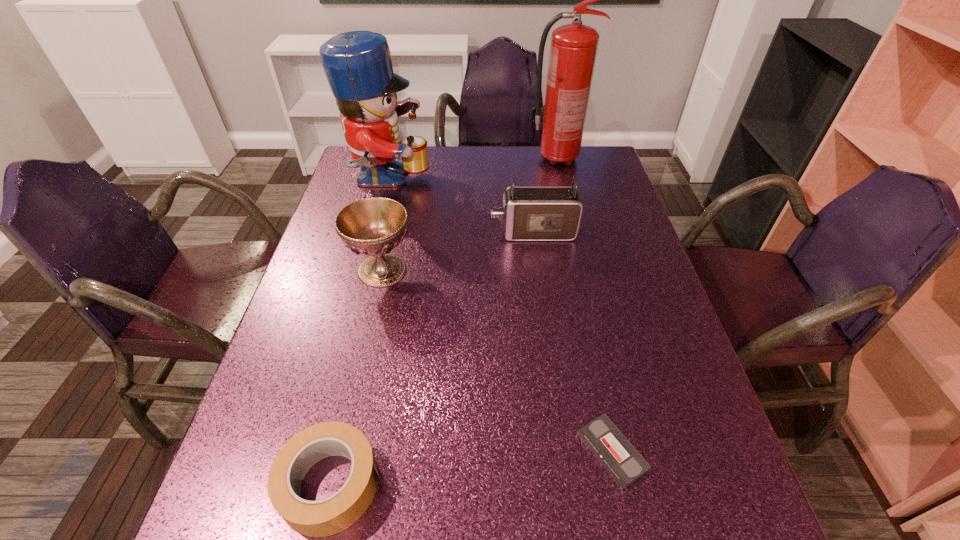
Where is `vacant space that satisfies the following two spatial constraints: 1. on the front-facing side of the nutcracker; 2. on the right side of the chalice`? The image size is (960, 540). vacant space that satisfies the following two spatial constraints: 1. on the front-facing side of the nutcracker; 2. on the right side of the chalice is located at coordinates (365, 270).

At what (x,y) coordinates should I click in order to perform the action: click on vacant region that satisfies the following two spatial constraints: 1. at the lens of the third farthest object; 2. on the right side of the videotape. Please return your answer as a coordinate pair (x, y). The height and width of the screenshot is (540, 960). Looking at the image, I should click on (563, 451).